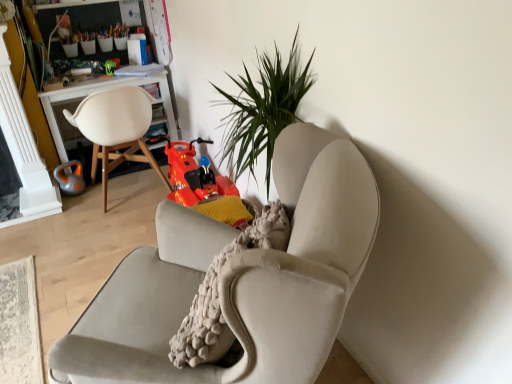
Question: Considering the relative sizes of white wood desk at left and shiny green toy at upper left, placed as the second toy when sorted from bottom to top, in the image provided, is white wood desk at left bigger than shiny green toy at upper left, placed as the second toy when sorted from bottom to top,?

Choices:
 (A) yes
 (B) no

Answer: (A)

Question: Considering the relative sizes of white wood desk at left and shiny green toy at upper left, which appears as the 1th toy when viewed from the top, in the image provided, is white wood desk at left smaller than shiny green toy at upper left, which appears as the 1th toy when viewed from the top,?

Choices:
 (A) yes
 (B) no

Answer: (B)

Question: From the image's perspective, is white wood desk at left under shiny green toy at upper left, which is the 2th toy in left-to-right order?

Choices:
 (A) yes
 (B) no

Answer: (A)

Question: From the image's perspective, is white wood desk at left on shiny green toy at upper left, which is the 2th toy in left-to-right order?

Choices:
 (A) no
 (B) yes

Answer: (A)

Question: Is white wood desk at left behind shiny green toy at upper left, which appears as the 1th toy when viewed from the top?

Choices:
 (A) no
 (B) yes

Answer: (A)

Question: Do you think white matte chair at left, which is counted as the 1th chair, starting from the left, is within shiny green toy at upper left, placed as the second toy when sorted from bottom to top, or outside of it?

Choices:
 (A) inside
 (B) outside

Answer: (B)

Question: From the image's perspective, is white matte chair at left, which is counted as the 1th chair, starting from the left, positioned above or below shiny green toy at upper left, placed as the second toy when sorted from bottom to top?

Choices:
 (A) below
 (B) above

Answer: (A)

Question: Looking at the image, does white matte chair at left, placed as the 2th chair when sorted from right to left, seem bigger or smaller compared to shiny green toy at upper left, placed as the second toy when sorted from bottom to top?

Choices:
 (A) small
 (B) big

Answer: (B)

Question: From their relative heights in the image, would you say white matte chair at left, which is counted as the 1th chair, starting from the left, is taller or shorter than shiny green toy at upper left, which is the 2th toy in left-to-right order?

Choices:
 (A) tall
 (B) short

Answer: (A)

Question: Based on their positions, is shiny green toy at upper left, which appears as the 1th toy when viewed from the top, located to the left or right of orange rubber kettlebell at left, the first toy positioned from the bottom?

Choices:
 (A) left
 (B) right

Answer: (B)

Question: Choose the correct answer: Is shiny green toy at upper left, which appears as the 1th toy when viewed from the top, inside orange rubber kettlebell at left, the first toy positioned from the bottom, or outside it?

Choices:
 (A) outside
 (B) inside

Answer: (A)

Question: From the image's perspective, is shiny green toy at upper left, which appears as the 1th toy when viewed from the top, above or below orange rubber kettlebell at left, the first toy positioned from the bottom?

Choices:
 (A) above
 (B) below

Answer: (A)

Question: From a real-world perspective, relative to orange rubber kettlebell at left, which is the second toy from top to bottom, is shiny green toy at upper left, which appears as the 1th toy when viewed from the top, vertically above or below?

Choices:
 (A) below
 (B) above

Answer: (B)

Question: Is orange rubber kettlebell at left, marked as the second toy in a right-to-left arrangement, to the left or to the right of white wood desk at left in the image?

Choices:
 (A) right
 (B) left

Answer: (B)

Question: Is orange rubber kettlebell at left, the first toy positioned from the bottom, wider or thinner than white wood desk at left?

Choices:
 (A) wide
 (B) thin

Answer: (B)